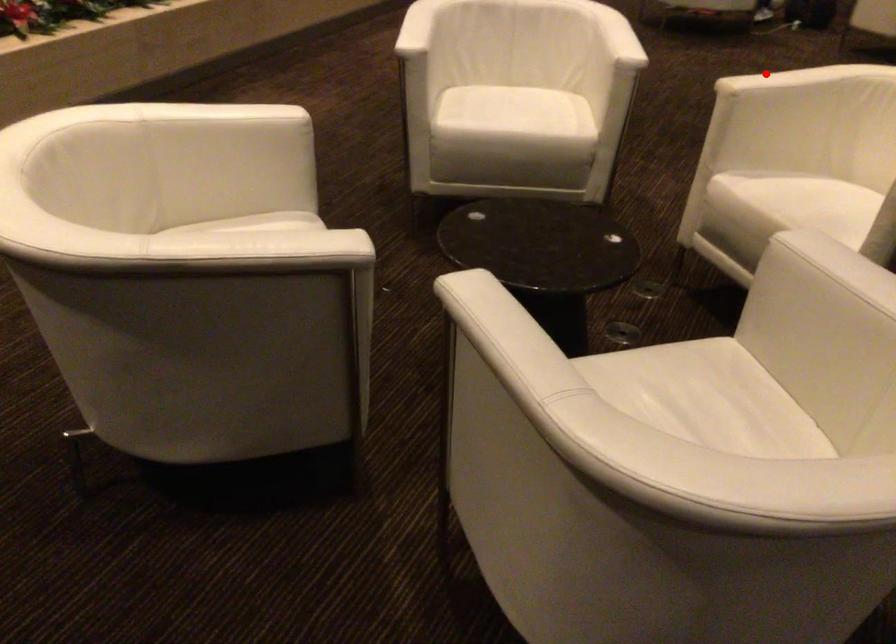
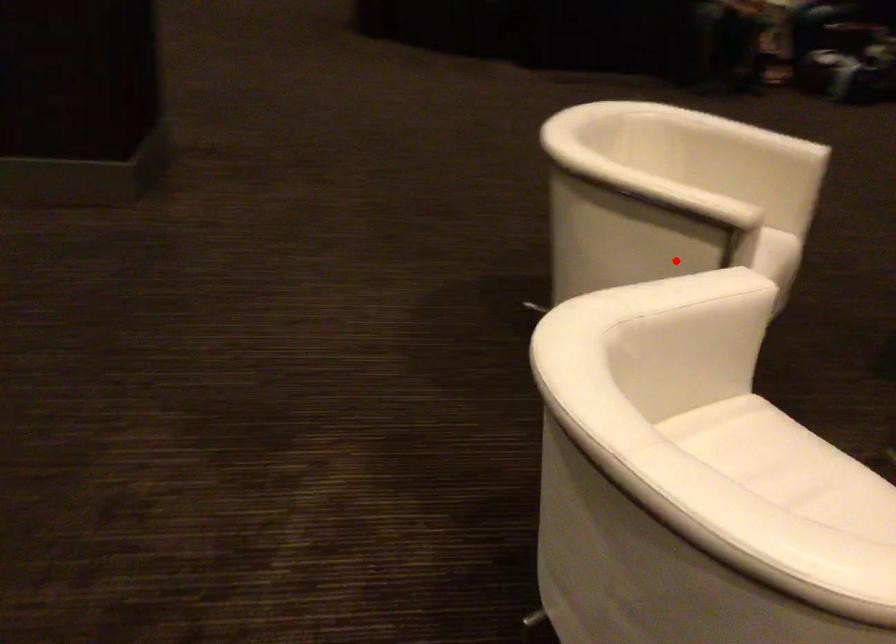
I am providing you with two images of the same scene from different viewpoints. A red point is marked on the first image and another point is marked on the second image. Are the points marked in image1 and image2 representing the same 3D position?

No